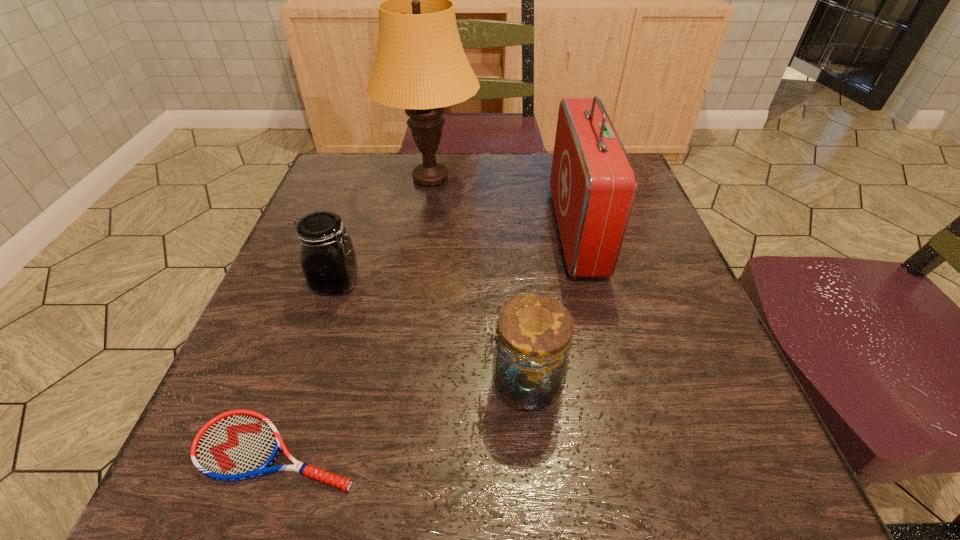
In order to click on free spot between the nearer jar and the lampshade in this screenshot , I will do `click(477, 281)`.

Choose which object is the second nearest neighbor to the tennis racket. Please provide its 2D coordinates. Your answer should be formatted as a tuple, i.e. [(x, y)], where the tuple contains the x and y coordinates of a point satisfying the conditions above.

[(327, 256)]

Choose which object is the third nearest neighbor to the nearer jar. Please provide its 2D coordinates. Your answer should be formatted as a tuple, i.e. [(x, y)], where the tuple contains the x and y coordinates of a point satisfying the conditions above.

[(327, 256)]

You are a GUI agent. You are given a task and a screenshot of the screen. Output one action in this format:
    pyautogui.click(x=<x>, y=<y>)
    Task: Click on the free space that satisfies the following two spatial constraints: 1. on the back side of the lampshade; 2. on the right side of the shortest object
    
    Given the screenshot: What is the action you would take?
    pyautogui.click(x=370, y=178)

Where is `vacant space that satisfies the following two spatial constraints: 1. on the front side of the lampshade; 2. on the lid of the left jar`? vacant space that satisfies the following two spatial constraints: 1. on the front side of the lampshade; 2. on the lid of the left jar is located at coordinates (416, 283).